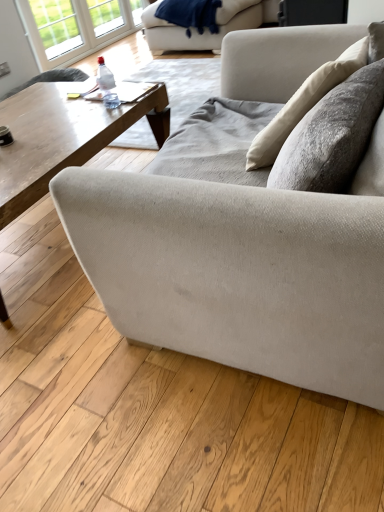
Question: Considering the relative sizes of white glass window at upper left, which is the 2th window in left-to-right order, and wooden coffee table at center in the image provided, is white glass window at upper left, which is the 2th window in left-to-right order, wider than wooden coffee table at center?

Choices:
 (A) yes
 (B) no

Answer: (B)

Question: Could you tell me if white glass window at upper left, which is the 2th window in left-to-right order, is turned towards wooden coffee table at center?

Choices:
 (A) yes
 (B) no

Answer: (B)

Question: Is there a large distance between white glass window at upper left, the first window in the right-to-left sequence, and wooden coffee table at center?

Choices:
 (A) no
 (B) yes

Answer: (B)

Question: Is white glass window at upper left, which is the 2th window in left-to-right order, behind wooden coffee table at center?

Choices:
 (A) yes
 (B) no

Answer: (A)

Question: From a real-world perspective, is white glass window at upper left, which is the 2th window in left-to-right order, located beneath wooden coffee table at center?

Choices:
 (A) no
 (B) yes

Answer: (A)

Question: Is white glass window at upper left, the first window in the right-to-left sequence, inside or outside of textured beige couch at center, positioned as the second studio couch in top-to-bottom order?

Choices:
 (A) inside
 (B) outside

Answer: (B)

Question: Is point (34, 26) positioned closer to the camera than point (122, 216)?

Choices:
 (A) closer
 (B) farther

Answer: (B)

Question: In the image, is white glass window at upper left, the first window in the right-to-left sequence, on the left side or the right side of textured beige couch at center, the 2th studio couch positioned from the back?

Choices:
 (A) right
 (B) left

Answer: (B)

Question: Considering their positions, is white glass window at upper left, which is the 2th window in left-to-right order, located in front of or behind textured beige couch at center, the 2th studio couch positioned from the back?

Choices:
 (A) front
 (B) behind

Answer: (B)

Question: Considering the positions of velvety blue blanket at upper center and beige fabric couch at upper center, the second studio couch positioned from the front, in the image, is velvety blue blanket at upper center bigger or smaller than beige fabric couch at upper center, the second studio couch positioned from the front,?

Choices:
 (A) small
 (B) big

Answer: (A)

Question: Considering the positions of point (215, 27) and point (150, 14), is point (215, 27) closer or farther from the camera than point (150, 14)?

Choices:
 (A) closer
 (B) farther

Answer: (A)

Question: Is velvety blue blanket at upper center in front of or behind beige fabric couch at upper center, the second studio couch positioned from the front, in the image?

Choices:
 (A) front
 (B) behind

Answer: (A)

Question: Is velvety blue blanket at upper center wider or thinner than beige fabric couch at upper center, the second studio couch positioned from the front?

Choices:
 (A) wide
 (B) thin

Answer: (B)

Question: Relative to velvety blue blanket at upper center, is beige fabric couch at upper center, placed as the first studio couch when sorted from back to front, in front or behind?

Choices:
 (A) behind
 (B) front

Answer: (A)

Question: From the image's perspective, relative to velvety blue blanket at upper center, is beige fabric couch at upper center, which ranks as the second studio couch in bottom-to-top order, above or below?

Choices:
 (A) below
 (B) above

Answer: (B)